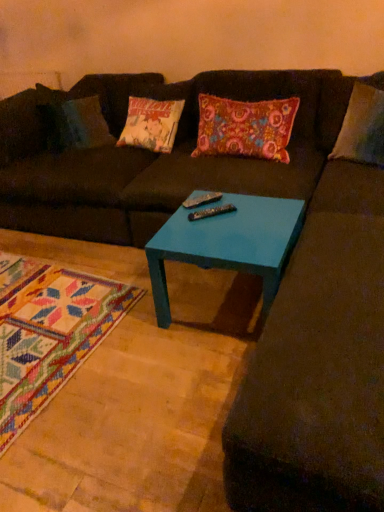
Identify the location of vacant space situated on the left part of teal glossy table at center. (122, 331).